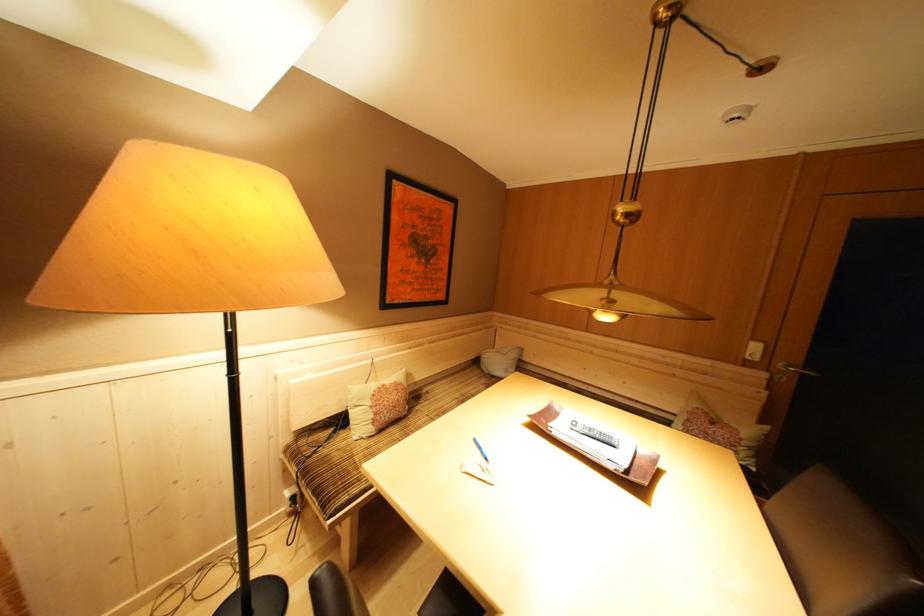
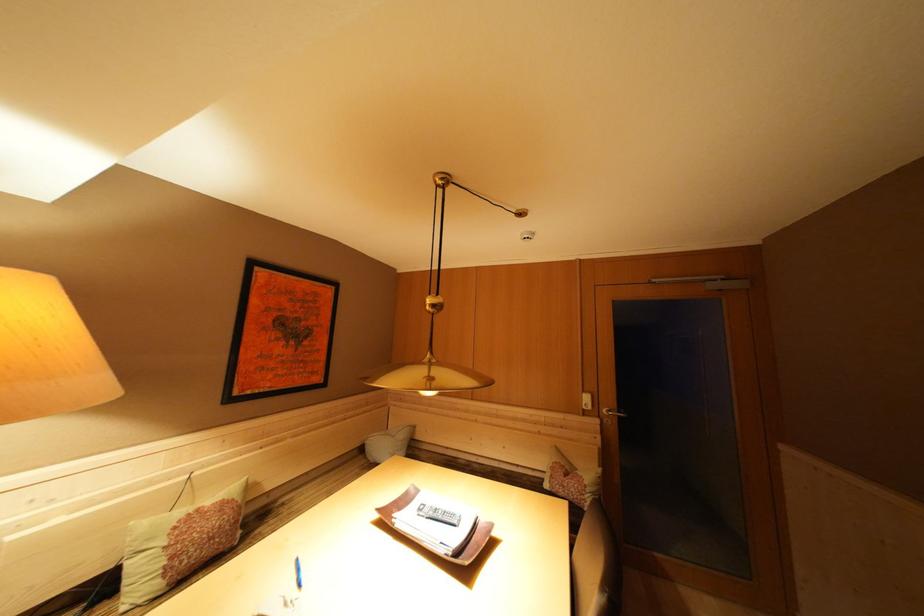
In the second image, find the point that corresponds to [772,370] in the first image.

(602, 418)